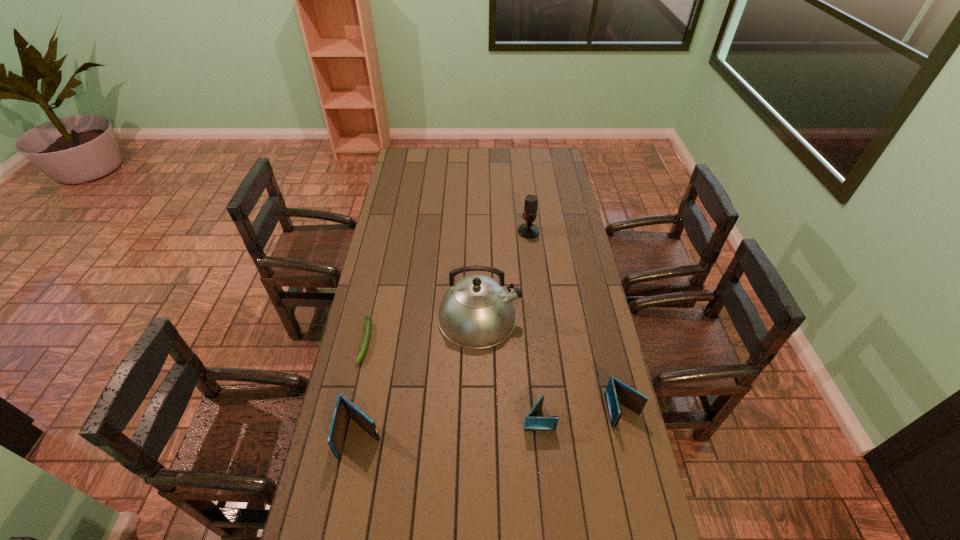
Image resolution: width=960 pixels, height=540 pixels. Find the location of `the tallest wallet`. the tallest wallet is located at coordinates (344, 407).

Where is `the leftmost wallet`? the leftmost wallet is located at coordinates (344, 407).

Where is `the shortest wallet`? The height and width of the screenshot is (540, 960). the shortest wallet is located at coordinates coord(532,423).

This screenshot has width=960, height=540. I want to click on the second wallet from left to right, so click(x=532, y=423).

I want to click on the rightmost object, so click(617, 392).

This screenshot has width=960, height=540. Find the location of `the fourth tallest object`. the fourth tallest object is located at coordinates (617, 392).

The width and height of the screenshot is (960, 540). In order to click on the shortest object in this screenshot , I will do `click(367, 325)`.

Where is `microphone`? microphone is located at coordinates (528, 230).

The width and height of the screenshot is (960, 540). Identify the location of the farthest object. (528, 230).

Where is `kettle`? This screenshot has height=540, width=960. kettle is located at coordinates (477, 311).